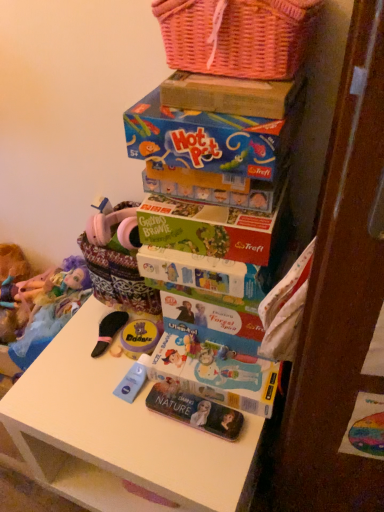
Identify the location of vacant position to the left of metallic silver magazine at lower center. This screenshot has height=512, width=384. (115, 419).